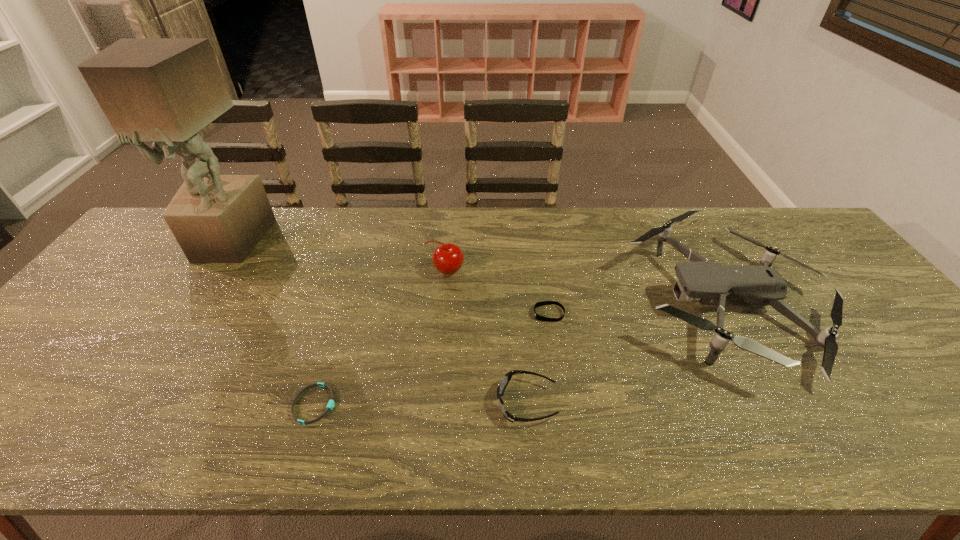
This screenshot has width=960, height=540. What are the coordinates of `free area in between the sculpture and the sunglasses` in the screenshot? It's located at (378, 322).

Find the location of `vacant space that is in between the third object from left to right and the leftmost object`. vacant space that is in between the third object from left to right and the leftmost object is located at coordinates (338, 256).

You are a GUI agent. You are given a task and a screenshot of the screen. Output one action in this format:
    pyautogui.click(x=<x>, y=<y>)
    Task: Click on the second closest object to the right wristband
    
    Given the screenshot: What is the action you would take?
    pyautogui.click(x=711, y=284)

Select which object is the closest to the cherry. Please provide its 2D coordinates. Your answer should be formatted as a tuple, i.e. [(x, y)], where the tuple contains the x and y coordinates of a point satisfying the conditions above.

[(542, 303)]